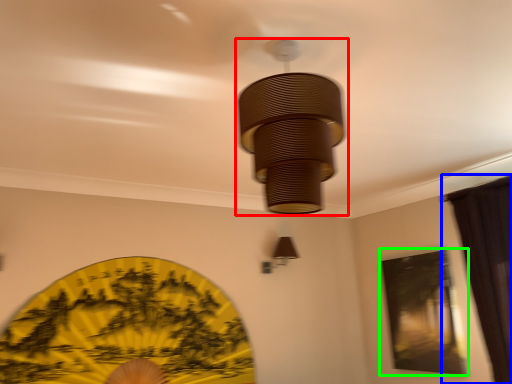
Question: Which object is positioned closest to lamp (highlighted by a red box)? Select from curtain (highlighted by a blue box) and window screen (highlighted by a green box).

Choices:
 (A) curtain
 (B) window screen

Answer: (A)